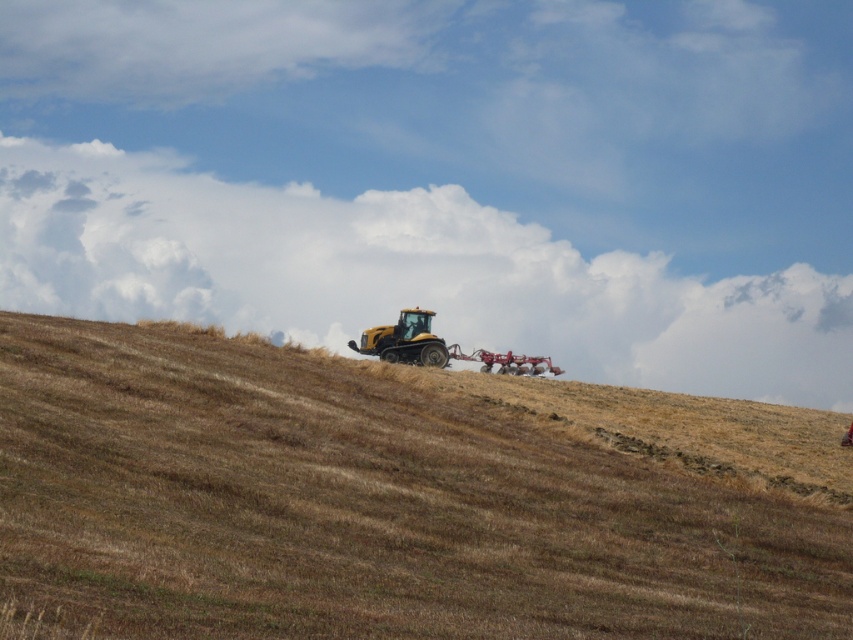
Question: Where is brown grassy hillside at center located in relation to yellow matte tractor at center in the image?

Choices:
 (A) below
 (B) above

Answer: (A)

Question: Does brown grassy hillside at center have a lesser width compared to yellow matte tractor at center?

Choices:
 (A) yes
 (B) no

Answer: (B)

Question: Which point is closer to the camera taking this photo?

Choices:
 (A) (282, 451)
 (B) (415, 340)

Answer: (A)

Question: Which point is farther to the camera?

Choices:
 (A) (399, 353)
 (B) (109, 410)

Answer: (A)

Question: Can you confirm if brown grassy hillside at center is wider than yellow matte tractor at center?

Choices:
 (A) yes
 (B) no

Answer: (A)